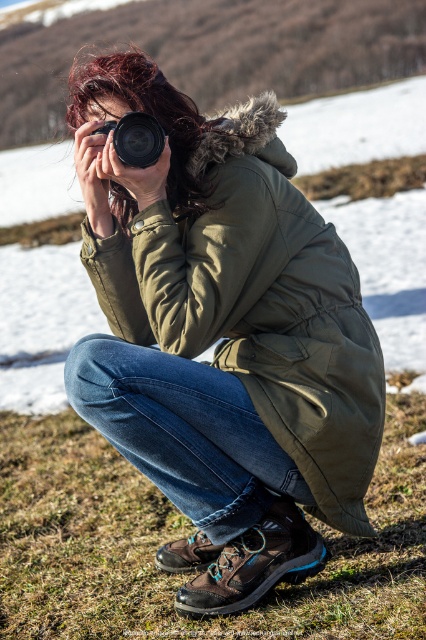
You are a photographer trying to capture a landscape photo. You notice your denim jeans at lower center and black plastic camera at center. Which item is positioned lower in the image?

The denim jeans at lower center are positioned lower in the image than the black plastic camera at center.

You are a photographer trying to capture the perfect shot of the olive green parka at center and denim jeans at lower center. Since you want to highlight both items equally in your photo, which one should you zoom in on more to balance their sizes in the frame?

The olive green parka at center is wider than the denim jeans at lower center, so you should zoom in more on the denim jeans at lower center to balance their sizes in the frame.

Looking at this image, you are a photographer preparing to take a picture of the olive green parka at center and the denim jeans at lower center. If your camera can only focus on objects within a 10 inch range, will both items be in focus?

The olive green parka at center and denim jeans at lower center are 9.42 inches apart, so yes, both items will be within the 10 inch focus range of the camera.